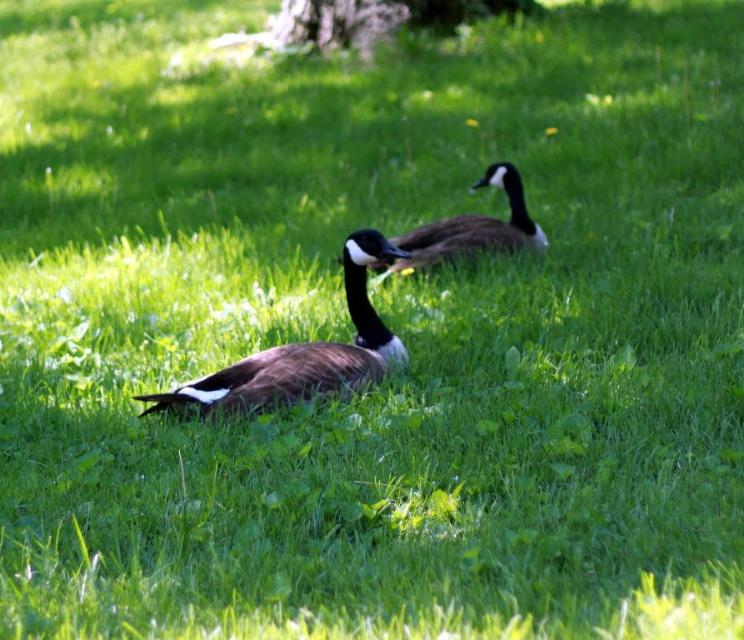
Who is taller, brown matte goose at center or brown speckled goose at center?

A: With more height is brown matte goose at center.

Between brown matte goose at center and brown speckled goose at center, which one appears on the left side from the viewer's perspective?

Positioned to the left is brown matte goose at center.

Is point (272, 358) behind point (504, 172)?

No, it is in front of (504, 172).

Locate an element on the screen. brown matte goose at center is located at coordinates (304, 353).

Can you confirm if smooth bark tree at upper center is positioned to the left of brown speckled goose at center?

Correct, you'll find smooth bark tree at upper center to the left of brown speckled goose at center.

Which of these two, smooth bark tree at upper center or brown speckled goose at center, stands shorter?

brown speckled goose at center is shorter.

The height and width of the screenshot is (640, 744). Describe the element at coordinates (376, 19) in the screenshot. I see `smooth bark tree at upper center` at that location.

You are a GUI agent. You are given a task and a screenshot of the screen. Output one action in this format:
    pyautogui.click(x=<x>, y=<y>)
    Task: Click on the smooth bark tree at upper center
    
    Given the screenshot: What is the action you would take?
    pyautogui.click(x=376, y=19)

Identify the location of brown matte goose at center. Image resolution: width=744 pixels, height=640 pixels. (304, 353).